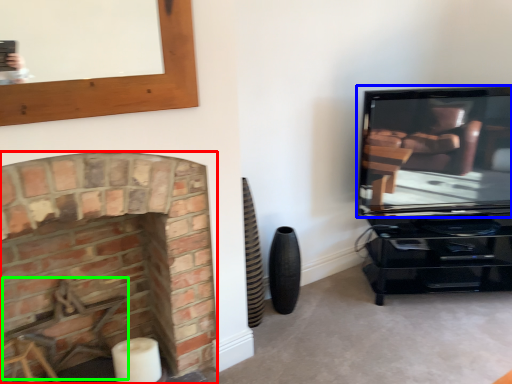
Question: Considering the real-world distances, which object is farthest from fireplace (highlighted by a red box)? television (highlighted by a blue box) or swivel chair (highlighted by a green box)?

Choices:
 (A) television
 (B) swivel chair

Answer: (A)